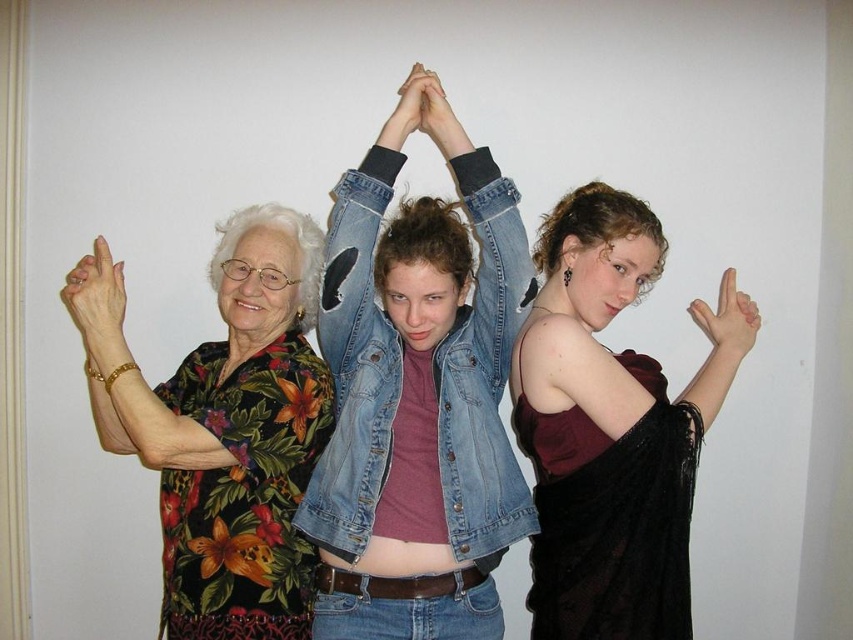
You are standing in front of the image and want to touch both points mentioned. Which point should you reach for first, point (210, 387) or point (442, 108)?

You should reach for point (210, 387) first because it is closer to you than point (442, 108).

You are a photographer adjusting the lighting for a group photo. You notice a point at coordinates (416, 406) on the image. What object does this point correspond to?

The point at coordinates (416, 406) corresponds to the faded denim jacket at center.

You are a photographer trying to capture a group photo of the floral print shirt at left and the matte denim jacket at center. Since you want to ensure both subjects are centered in the frame, which direction should you move the camera to align them properly?

Since the floral print shirt at left is to the left of the matte denim jacket at center, you should move the camera slightly to the left to center both subjects in the frame.